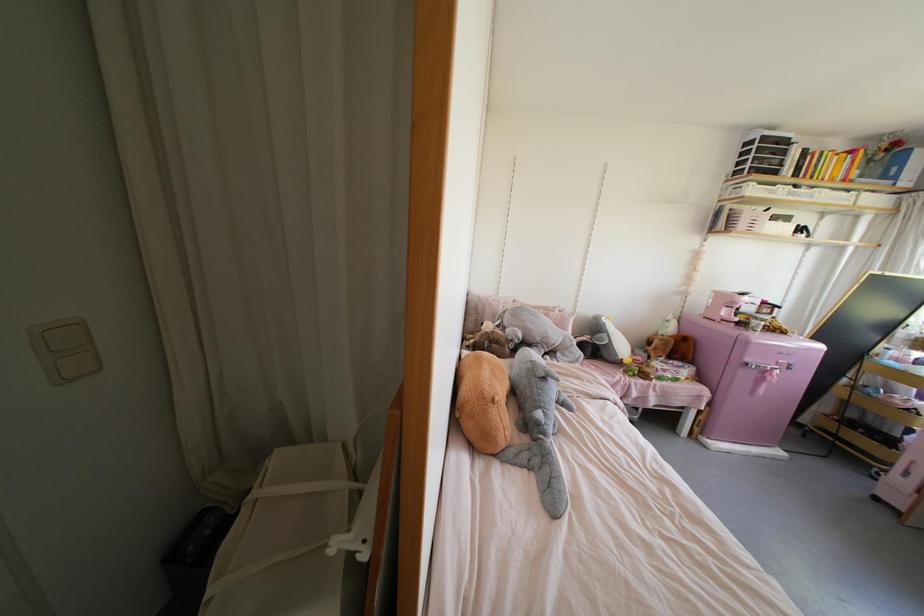
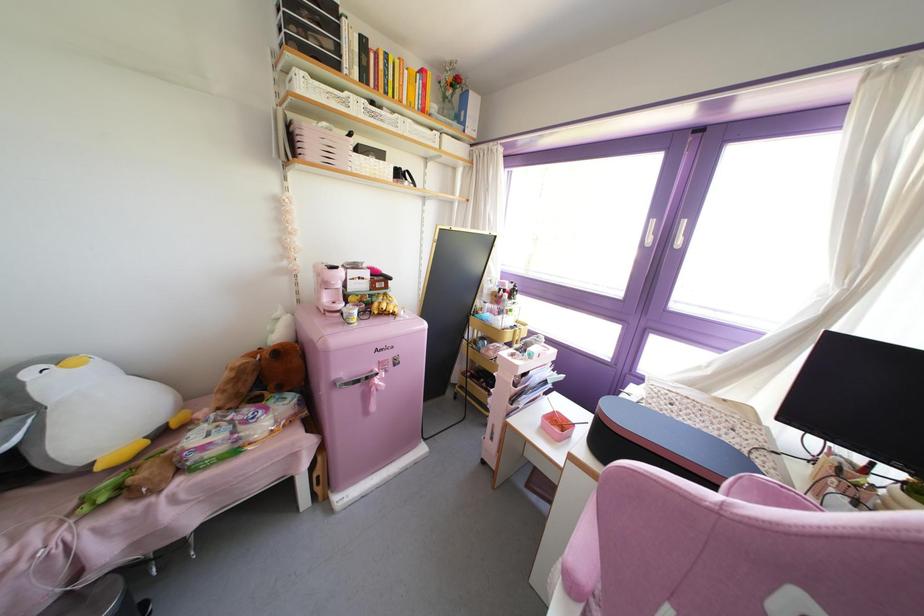
The point at (624, 361) is marked in the first image. Where is the corresponding point in the second image?

(99, 467)